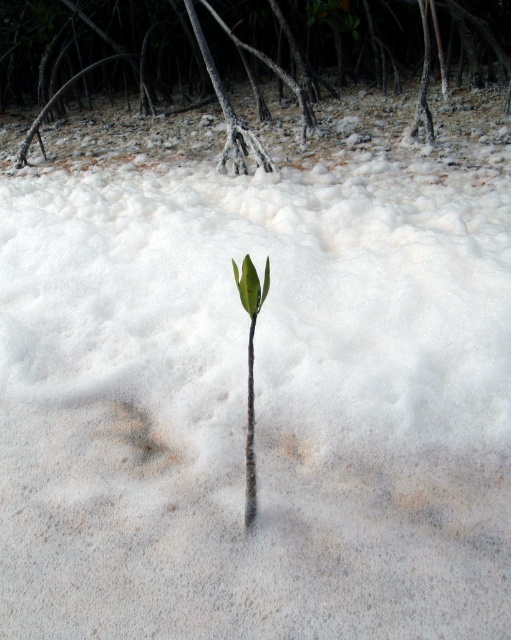
Question: Is brown rough mangrove root at center to the right of green matte leaf at center from the viewer's perspective?

Choices:
 (A) yes
 (B) no

Answer: (B)

Question: Can you confirm if brown rough mangrove root at center is bigger than green matte leaf at center?

Choices:
 (A) yes
 (B) no

Answer: (A)

Question: Which point is farther to the camera?

Choices:
 (A) green matte leaf at center
 (B) brown rough mangrove root at center

Answer: (B)

Question: Can you confirm if brown rough mangrove root at center is positioned above green matte leaf at center?

Choices:
 (A) no
 (B) yes

Answer: (B)

Question: Which object appears closest to the camera in this image?

Choices:
 (A) green matte leaf at center
 (B) brown rough mangrove root at center

Answer: (A)